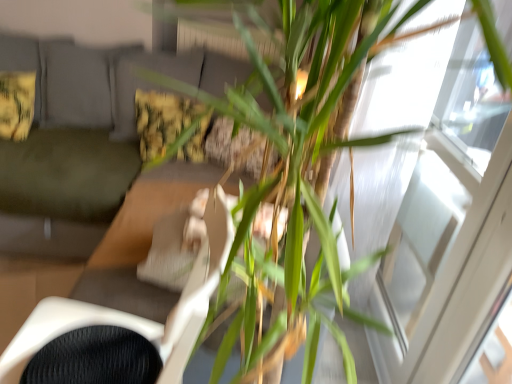
Question: Can you confirm if green fabric couch at left is shorter than green leafy plant at center?

Choices:
 (A) no
 (B) yes

Answer: (B)

Question: Considering the relative sizes of green fabric couch at left and green leafy plant at center in the image provided, is green fabric couch at left smaller than green leafy plant at center?

Choices:
 (A) yes
 (B) no

Answer: (B)

Question: Is green fabric couch at left next to green leafy plant at center and touching it?

Choices:
 (A) yes
 (B) no

Answer: (B)

Question: Could you tell me if green fabric couch at left is turned towards green leafy plant at center?

Choices:
 (A) no
 (B) yes

Answer: (A)

Question: From a real-world perspective, is green fabric couch at left physically below green leafy plant at center?

Choices:
 (A) no
 (B) yes

Answer: (B)

Question: Is green leafy plant at center wider or thinner than white mesh swivel chair at center?

Choices:
 (A) wide
 (B) thin

Answer: (A)

Question: From a real-world perspective, is green leafy plant at center above or below white mesh swivel chair at center?

Choices:
 (A) below
 (B) above

Answer: (B)

Question: From the image's perspective, is green leafy plant at center located above or below white mesh swivel chair at center?

Choices:
 (A) below
 (B) above

Answer: (B)

Question: Is green leafy plant at center inside the boundaries of white mesh swivel chair at center, or outside?

Choices:
 (A) inside
 (B) outside

Answer: (B)

Question: Is point click(14, 100) closer or farther from the camera than point click(160, 342)?

Choices:
 (A) closer
 (B) farther

Answer: (B)

Question: Is fluffy yellow pillow at upper left, the 2th pillow when ordered from right to left, situated inside white mesh swivel chair at center or outside?

Choices:
 (A) outside
 (B) inside

Answer: (A)

Question: From the image's perspective, is fluffy yellow pillow at upper left, the 2th pillow when ordered from right to left, above or below white mesh swivel chair at center?

Choices:
 (A) below
 (B) above

Answer: (B)

Question: Considering their positions, is fluffy yellow pillow at upper left, which is the first pillow from left to right, located in front of or behind white mesh swivel chair at center?

Choices:
 (A) front
 (B) behind

Answer: (B)

Question: Is point (156, 332) closer or farther from the camera than point (476, 276)?

Choices:
 (A) closer
 (B) farther

Answer: (B)

Question: Relative to transparent glass window at upper right, is white mesh swivel chair at center in front or behind?

Choices:
 (A) behind
 (B) front

Answer: (B)